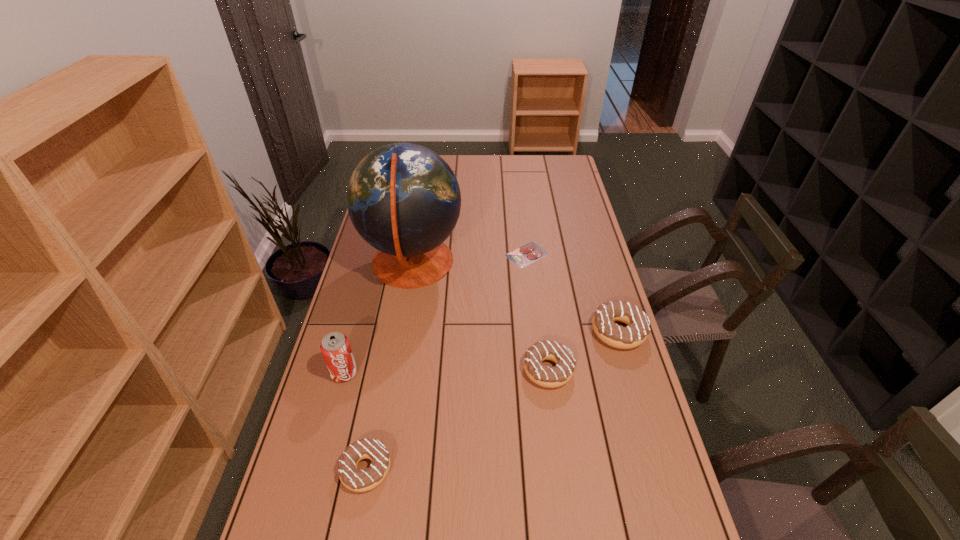
Where is `the nearest object`? The width and height of the screenshot is (960, 540). the nearest object is located at coordinates (356, 480).

The image size is (960, 540). Identify the location of the second shortest object. (356, 480).

Identify the location of the third shortest object. The width and height of the screenshot is (960, 540). (551, 377).

Identify the location of the second doughnut from right to left. The width and height of the screenshot is (960, 540). (551, 377).

At what (x,y) coordinates should I click in order to perform the action: click on the rightmost object. Please return your answer as a coordinate pair (x, y). The height and width of the screenshot is (540, 960). Looking at the image, I should click on (638, 323).

The image size is (960, 540). Find the location of `salami`. salami is located at coordinates (531, 252).

The height and width of the screenshot is (540, 960). Identify the location of globe. (403, 199).

The height and width of the screenshot is (540, 960). What are the coordinates of `soda can` in the screenshot? It's located at (335, 347).

Find the location of a particular element. vacant space situated on the right of the shortest doughnut is located at coordinates (520, 469).

This screenshot has height=540, width=960. What are the coordinates of `free space located on the front of the second shortest doughnut` in the screenshot? It's located at (564, 494).